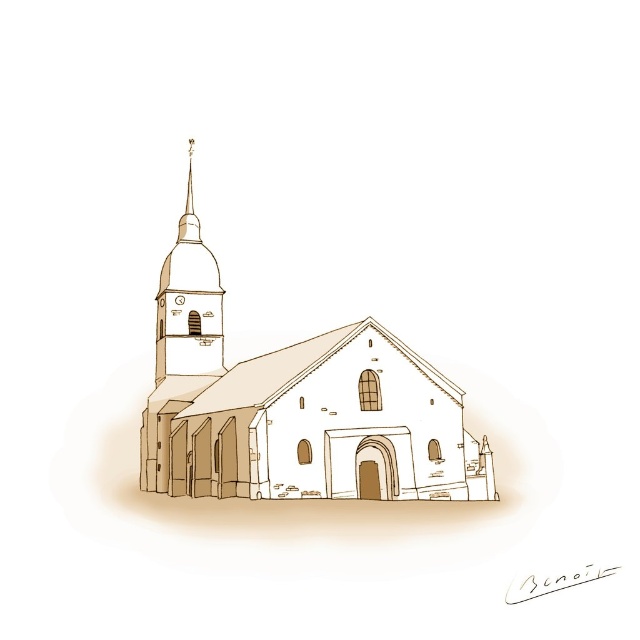
Question: Is brown textured church at center bigger than smooth beige spire at upper left?

Choices:
 (A) no
 (B) yes

Answer: (B)

Question: Is brown textured church at center behind smooth beige spire at upper left?

Choices:
 (A) yes
 (B) no

Answer: (B)

Question: Does brown textured church at center have a larger size compared to smooth beige spire at upper left?

Choices:
 (A) yes
 (B) no

Answer: (A)

Question: Which of the following is the closest to the observer?

Choices:
 (A) (276, 396)
 (B) (176, 323)

Answer: (A)